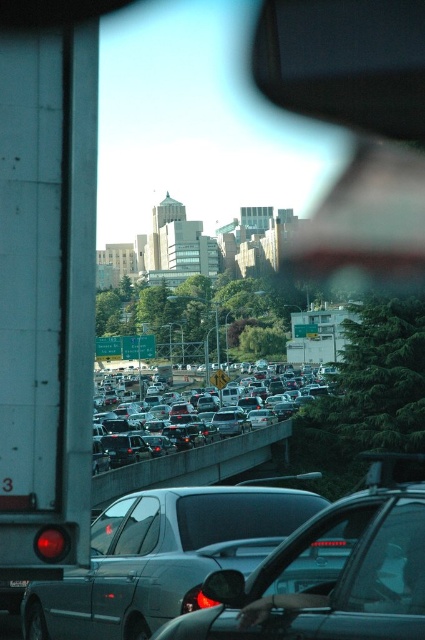
Does black plastic rearview mirror at upper right have a smaller size compared to black plastic license plate at center?

Incorrect, black plastic rearview mirror at upper right is not smaller in size than black plastic license plate at center.

What do you see at coordinates (345, 61) in the screenshot?
I see `black plastic rearview mirror at upper right` at bounding box center [345, 61].

This screenshot has height=640, width=425. Identify the location of black plastic rearview mirror at upper right. (345, 61).

Which is more to the left, white matte trailer truck at left or glossy plastic rearview mirror at upper right?

white matte trailer truck at left is more to the left.

Is point (90, 112) positioned after point (374, 177)?

No.

Which is in front, point (6, 216) or point (368, 200)?

Positioned in front is point (6, 216).

Image resolution: width=425 pixels, height=640 pixels. What are the coordinates of `white matte trailer truck at left` in the screenshot? It's located at (47, 294).

Between glossy plastic rearview mirror at upper right and metallic silver car at center, which one appears on the right side from the viewer's perspective?

Positioned to the right is glossy plastic rearview mirror at upper right.

Where is `glossy plastic rearview mirror at upper right`? glossy plastic rearview mirror at upper right is located at coordinates (354, 122).